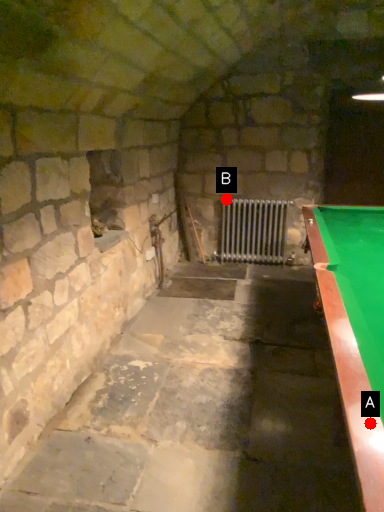
Question: Two points are circled on the image, labeled by A and B beside each circle. Which point is closer to the camera?

Choices:
 (A) A is closer
 (B) B is closer

Answer: (A)